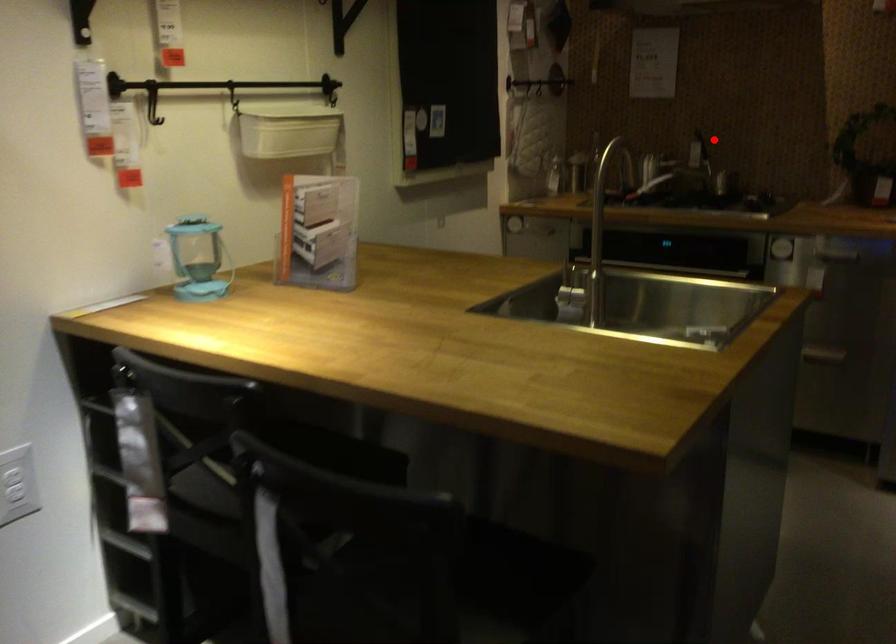
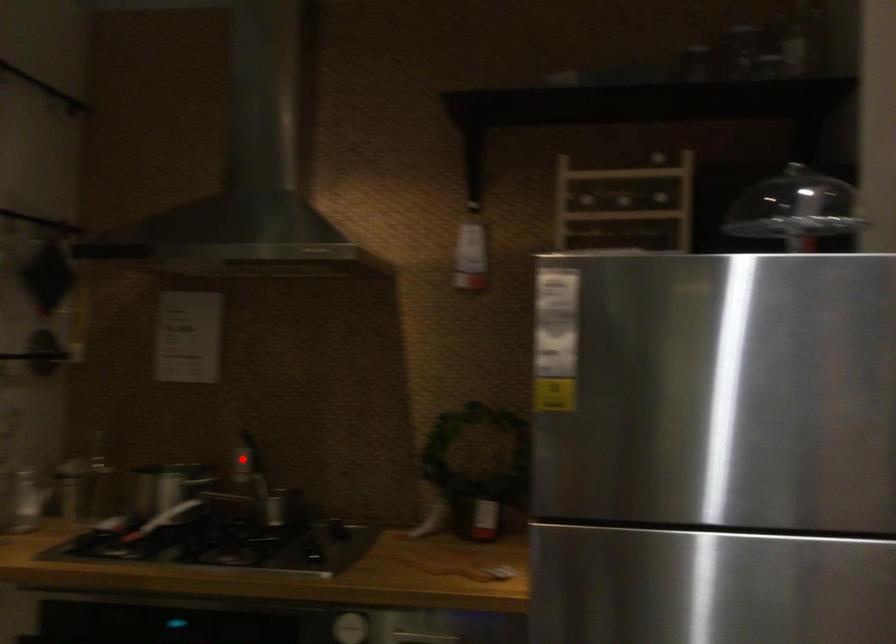
I am providing you with two images of the same scene from different viewpoints. A red point is marked on the first image and another point is marked on the second image. Is the red point in image1 aligned with the point shown in image2?

Yes